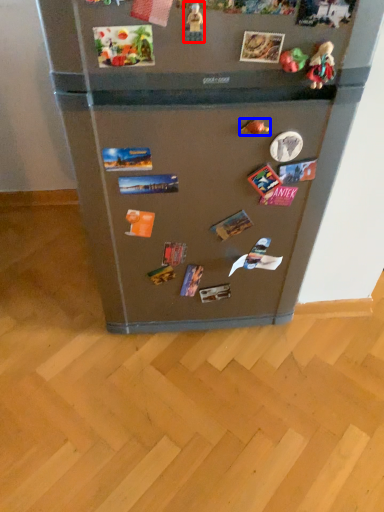
Question: Which object appears closest to the camera in this image, toy (highlighted by a red box) or toy (highlighted by a blue box)?

Choices:
 (A) toy
 (B) toy

Answer: (A)